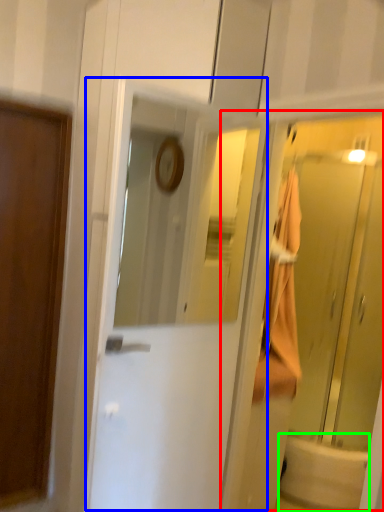
Question: Which object is the farthest from elevator (highlighted by a red box)? Choose among these: door (highlighted by a blue box) or bath (highlighted by a green box).

Choices:
 (A) door
 (B) bath

Answer: (A)